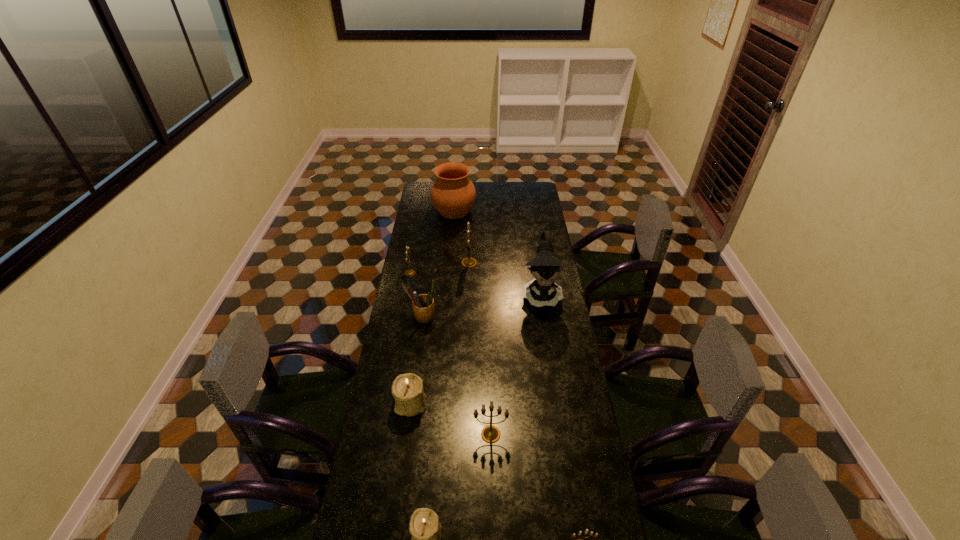
Locate an element on the screen. blank space located on the back of the farthest object is located at coordinates (456, 186).

Locate an element on the screen. free region located 0.320m on the back of the tallest candelabrum is located at coordinates (470, 220).

What are the coordinates of `free location located 0.280m on the front of the pencil box` in the screenshot? It's located at (415, 380).

Find the location of a particular element. The width and height of the screenshot is (960, 540). vacant space situated 0.230m on the left of the second tallest candelabrum is located at coordinates (408, 434).

Find the location of a particular element. free location located on the right of the fourth nearest object is located at coordinates (451, 403).

Locate an element on the screen. free region located 0.370m on the front of the leftmost gold candelabrum is located at coordinates (398, 336).

Find the location of `object at the far edge`. object at the far edge is located at coordinates point(453,194).

Locate an element on the screen. The width and height of the screenshot is (960, 540). pottery at the left edge is located at coordinates (453, 194).

The image size is (960, 540). What are the coordinates of `pencil box present at the left edge` in the screenshot? It's located at (423, 305).

Where is `object positioned at the right edge`? This screenshot has width=960, height=540. object positioned at the right edge is located at coordinates (545, 267).